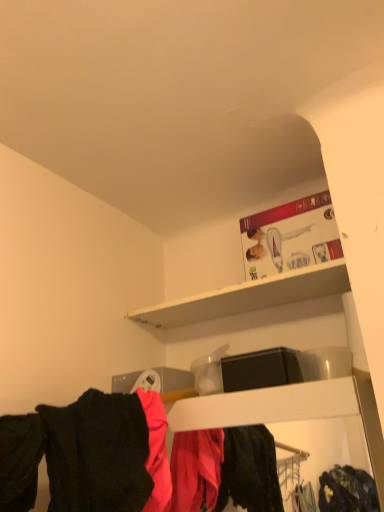
Image resolution: width=384 pixels, height=512 pixels. Identify the location of black matte shirt at lower left. (97, 453).

In order to face white matte shelf at upper center, should I rotate leftwards or rightwards?

Turn right approximately 5.853 degrees to face it.

Identify the location of matte black clothing at lower center. (89, 455).

Where is `black matte shirt at lower left`? Image resolution: width=384 pixels, height=512 pixels. black matte shirt at lower left is located at coordinates (97, 453).

Looking at this image, is white matte shelf at upper center facing towards black matte shirt at lower left?

No, white matte shelf at upper center does not turn towards black matte shirt at lower left.

Which object is positioned more to the right, white matte shelf at upper center or black matte shirt at lower left?

From the viewer's perspective, white matte shelf at upper center appears more on the right side.

Looking at this image, who is shorter, white matte shelf at upper center or black matte shirt at lower left?

white matte shelf at upper center is shorter.

Is white matte shelf at upper center next to black matte shirt at lower left?

No, white matte shelf at upper center is not touching black matte shirt at lower left.

Based on the photo, between matte black clothing at lower center and black matte shirt at lower left, which one has larger width?

Wider between the two is black matte shirt at lower left.

Considering the sizes of matte black clothing at lower center and black matte shirt at lower left in the image, is matte black clothing at lower center taller or shorter than black matte shirt at lower left?

Considering their sizes, matte black clothing at lower center has more height than black matte shirt at lower left.

Is the surface of matte black clothing at lower center in direct contact with black matte shirt at lower left?

Yes, matte black clothing at lower center is right next to black matte shirt at lower left and making contact.

Is point (92, 424) less distant than point (84, 509)?

No, it is not.

From the image's perspective, which one is positioned lower, matte black clothing at lower center or white matte shelf at upper center?

matte black clothing at lower center, from the image's perspective.

You are a GUI agent. You are given a task and a screenshot of the screen. Output one action in this format:
    pyautogui.click(x=<x>, y=<y>)
    Task: Click on the closet below the white matte shelf at upper center (from the image's perspective)
    The image size is (384, 512).
    Given the screenshot: What is the action you would take?
    pyautogui.click(x=89, y=455)

In the image, is matte black clothing at lower center positioned in front of or behind white matte shelf at upper center?

In the image, matte black clothing at lower center appears in front of white matte shelf at upper center.

Considering the sizes of objects matte black clothing at lower center and white matte shelf at upper center in the image provided, who is thinner, matte black clothing at lower center or white matte shelf at upper center?

white matte shelf at upper center.

Is black matte shirt at lower left completely or partially outside of matte black clothing at lower center?

black matte shirt at lower left lies outside matte black clothing at lower center's area.

Is black matte shirt at lower left oriented away from matte black clothing at lower center?

No, black matte shirt at lower left is not facing the opposite direction of matte black clothing at lower center.

Which of these two, black matte shirt at lower left or matte black clothing at lower center, is smaller?

Smaller between the two is black matte shirt at lower left.

In the scene shown: Which object is thinner, black matte shirt at lower left or white matte shelf at upper center?

white matte shelf at upper center.

How different are the orientations of black matte shirt at lower left and white matte shelf at upper center in degrees?

The angular difference between black matte shirt at lower left and white matte shelf at upper center is 92 degrees.

Visually, is black matte shirt at lower left positioned to the left or to the right of white matte shelf at upper center?

black matte shirt at lower left is to the left of white matte shelf at upper center.

Is black matte shirt at lower left placed right next to white matte shelf at upper center?

No.

Can you confirm if white matte shelf at upper center is taller than matte black clothing at lower center?

In fact, white matte shelf at upper center may be shorter than matte black clothing at lower center.

From a real-world perspective, which is physically above, white matte shelf at upper center or matte black clothing at lower center?

white matte shelf at upper center.

From the image's perspective, does white matte shelf at upper center appear higher than matte black clothing at lower center?

Yes.

Is white matte shelf at upper center smaller than matte black clothing at lower center?

Correct, white matte shelf at upper center occupies less space than matte black clothing at lower center.

This screenshot has width=384, height=512. Identify the location of clothing that appears on the left of white matte shelf at upper center. (97, 453).

The image size is (384, 512). I want to click on closet that is on the right side of black matte shirt at lower left, so click(89, 455).

Looking at the image, which one is located further to black matte shirt at lower left, matte black clothing at lower center or white matte shelf at upper center?

white matte shelf at upper center is positioned further to the anchor black matte shirt at lower left.

When comparing their distances from white matte shelf at upper center, does matte black clothing at lower center or black matte shirt at lower left seem closer?

matte black clothing at lower center.

From the image, which object appears to be nearer to white matte shelf at upper center, black matte shirt at lower left or matte black clothing at lower center?

The object closer to white matte shelf at upper center is matte black clothing at lower center.

Based on their spatial positions, is white matte shelf at upper center or matte black clothing at lower center further from black matte shirt at lower left?

white matte shelf at upper center is further to black matte shirt at lower left.

Based on the photo, looking at the image, which one is located further to matte black clothing at lower center, white matte shelf at upper center or black matte shirt at lower left?

white matte shelf at upper center.

Based on their spatial positions, is black matte shirt at lower left or white matte shelf at upper center closer to matte black clothing at lower center?

The object closer to matte black clothing at lower center is black matte shirt at lower left.

Identify the location of shelf between black matte shirt at lower left and matte black clothing at lower center. The image size is (384, 512). click(x=249, y=296).